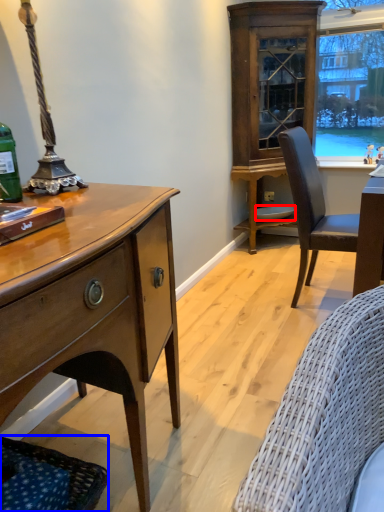
Question: Which of the following is the closest to the observer, plate (highlighted by a red box) or studio couch (highlighted by a blue box)?

Choices:
 (A) plate
 (B) studio couch

Answer: (B)